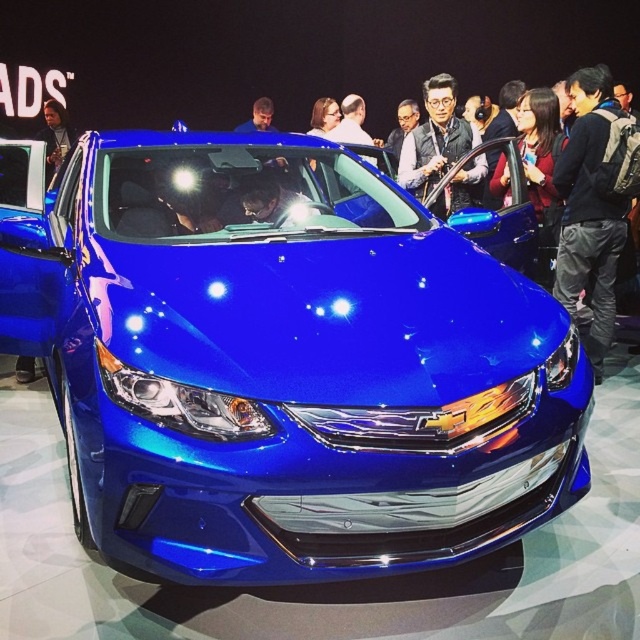
Can you confirm if black backpack at right is taller than matte black vest at center?

Yes, black backpack at right is taller than matte black vest at center.

Is point (579, 134) more distant than point (420, 131)?

No, (579, 134) is in front of (420, 131).

Which is behind, point (600, 333) or point (465, 200)?

Positioned behind is point (465, 200).

Identify the location of black backpack at right. This screenshot has width=640, height=640. (589, 211).

Who is more distant from viewer, (92, 522) or (61, 140)?

Positioned behind is point (61, 140).

Which is above, glossy metallic car at center or matte black jacket at upper left?

matte black jacket at upper left is above.

What do you see at coordinates (282, 358) in the screenshot? Image resolution: width=640 pixels, height=640 pixels. I see `glossy metallic car at center` at bounding box center [282, 358].

What are the coordinates of `glossy metallic car at center` in the screenshot? It's located at (282, 358).

The width and height of the screenshot is (640, 640). Describe the element at coordinates (282, 358) in the screenshot. I see `glossy metallic car at center` at that location.

Between glossy metallic car at center and black backpack at right, which one is positioned higher?

black backpack at right

You are a GUI agent. You are given a task and a screenshot of the screen. Output one action in this format:
    pyautogui.click(x=<x>, y=<y>)
    Task: Click on the glossy metallic car at center
    
    Given the screenshot: What is the action you would take?
    pyautogui.click(x=282, y=358)

Where is `glossy metallic car at center`? The width and height of the screenshot is (640, 640). glossy metallic car at center is located at coordinates point(282,358).